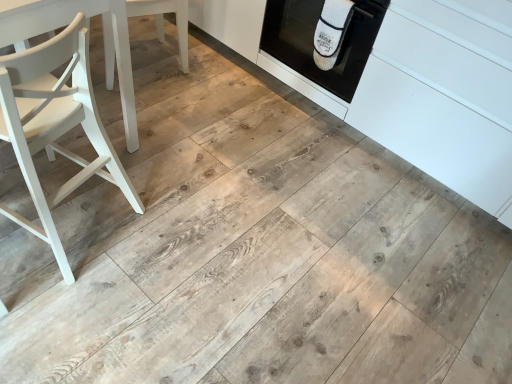
Find the location of a particular element. vacant area situated below white painted wood chair at left, which is counted as the 1th chair, starting from the bottom (from a real-world perspective) is located at coordinates (70, 222).